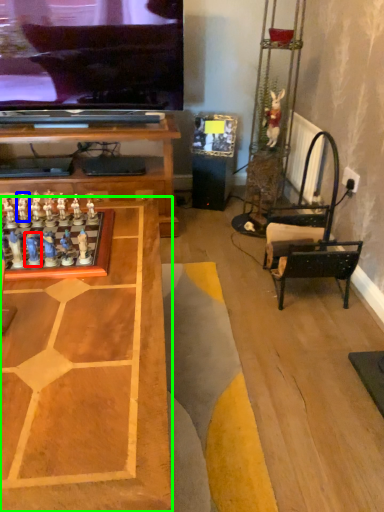
Question: Estimate the real-world distances between objects in this image. Which object is farther from toy (highlighted by a red box), toy (highlighted by a blue box) or table (highlighted by a green box)?

Choices:
 (A) toy
 (B) table

Answer: (B)